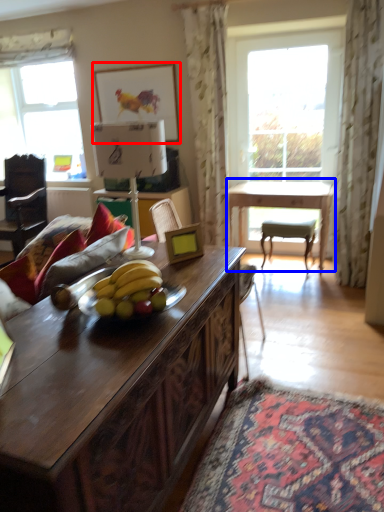
Question: Which of the following is the farthest to the observer, picture frame (highlighted by a red box) or table (highlighted by a blue box)?

Choices:
 (A) picture frame
 (B) table

Answer: (A)